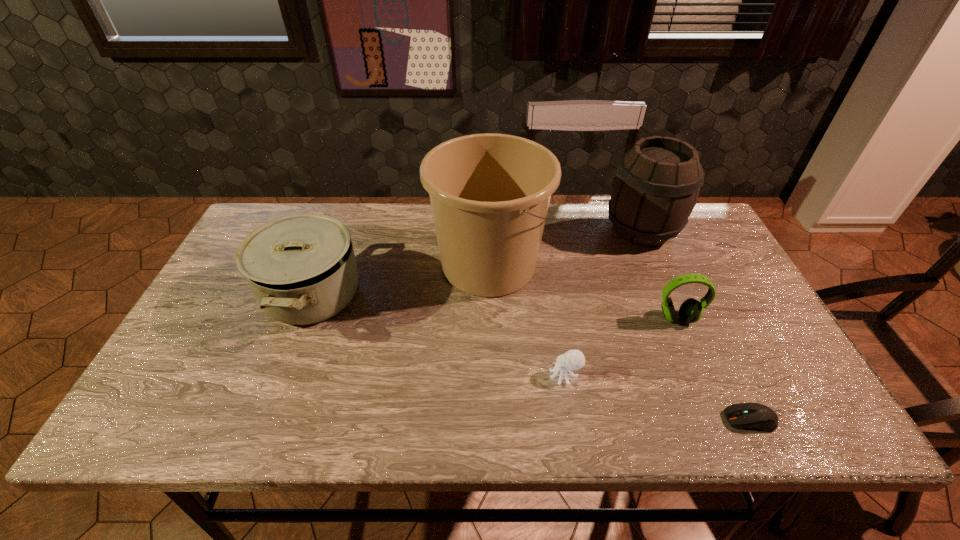
Identify the location of wine bucket at the far edge. (657, 182).

Identify the location of object that is at the near edge. The height and width of the screenshot is (540, 960). (757, 416).

The width and height of the screenshot is (960, 540). Find the location of `object at the left edge`. object at the left edge is located at coordinates (302, 269).

At what (x,y) coordinates should I click in order to perform the action: click on wine bucket that is at the right edge. Please return your answer as a coordinate pair (x, y). This screenshot has height=540, width=960. Looking at the image, I should click on tap(657, 182).

Locate an element on the screen. headset located in the right edge section of the desktop is located at coordinates (691, 310).

Find the location of a particular element. computer equipment located in the right edge section of the desktop is located at coordinates (757, 416).

The image size is (960, 540). Identify the location of object located at the far right corner. [x=657, y=182].

Where is `object located in the near right corner section of the desktop`? This screenshot has height=540, width=960. object located in the near right corner section of the desktop is located at coordinates (757, 416).

You are a GUI agent. You are given a task and a screenshot of the screen. Output one action in this format:
    pyautogui.click(x=<x>, y=<y>)
    Task: Click on the vacant space at the far edge of the desktop
    This screenshot has height=540, width=960.
    Given the screenshot: What is the action you would take?
    pyautogui.click(x=326, y=212)

Find the location of a particular element. The image size is (960, 540). blank area at the left edge is located at coordinates (215, 349).